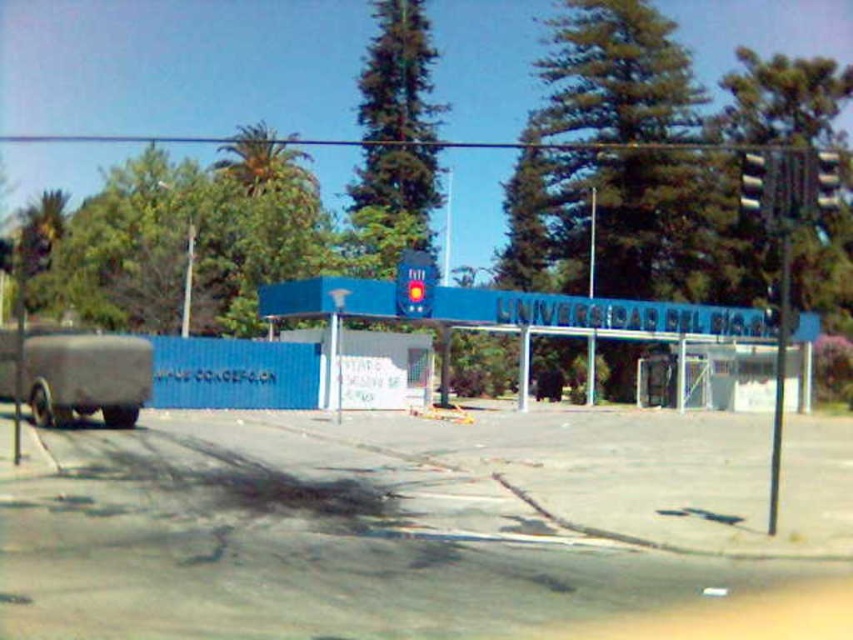
Question: Among these objects, which one is nearest to the camera?

Choices:
 (A) metallic gray traffic light at right
 (B) matte gray trailer at left
 (C) metallic pole at center

Answer: (A)

Question: Does metallic gray traffic light at right have a larger size compared to black plastic traffic light at upper right?

Choices:
 (A) no
 (B) yes

Answer: (A)

Question: Among these points, which one is farthest from the camera?

Choices:
 (A) (756, 205)
 (B) (589, 376)
 (C) (817, 170)

Answer: (B)

Question: Estimate the real-world distances between objects in this image. Which object is closer to the metallic pole at center?

Choices:
 (A) metallic gray traffic light at right
 (B) black plastic traffic light at upper right

Answer: (A)

Question: Can you confirm if metallic pole at right is positioned below metallic gray traffic light at right?

Choices:
 (A) no
 (B) yes

Answer: (B)

Question: Does matte gray trailer at left have a larger size compared to metallic pole at right?

Choices:
 (A) no
 (B) yes

Answer: (A)